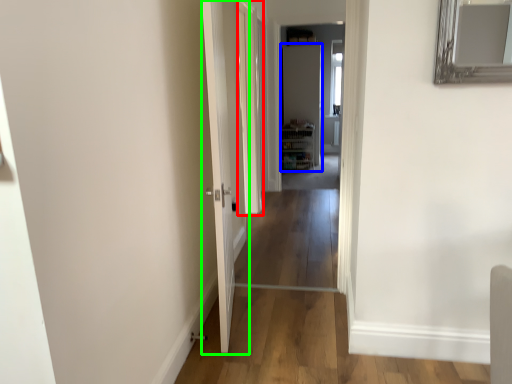
Question: Estimate the real-world distances between objects in this image. Which object is closer to glass door (highlighted by a red box), door (highlighted by a blue box) or door (highlighted by a green box)?

Choices:
 (A) door
 (B) door

Answer: (B)